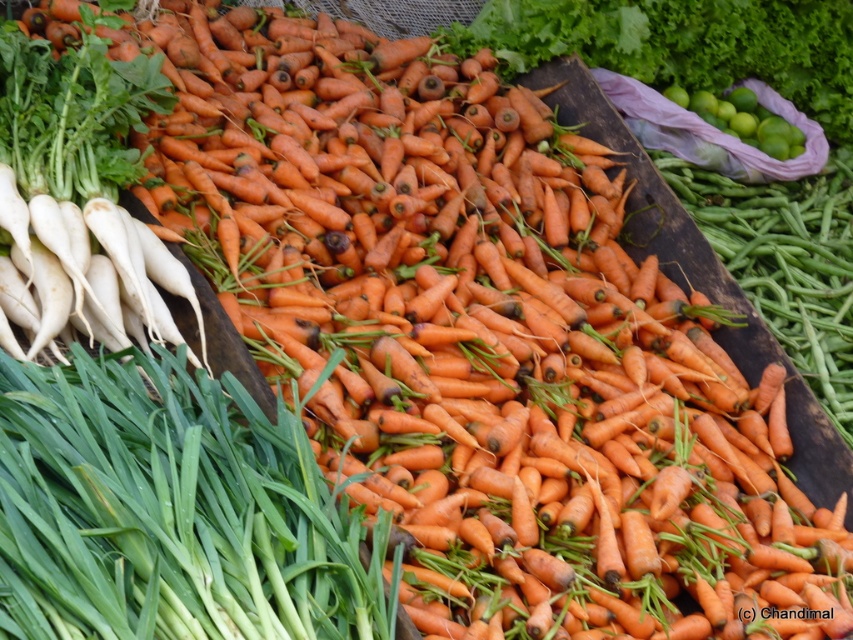
Does orange matte carrot at center-right have a larger size compared to green matte lime at upper right?

Correct, orange matte carrot at center-right is larger in size than green matte lime at upper right.

How much distance is there between orange matte carrot at center-right and green matte lime at upper right?

orange matte carrot at center-right and green matte lime at upper right are 76.03 centimeters apart from each other.

Locate an element on the screen. orange matte carrot at center-right is located at coordinates (786, 260).

From the picture: Is white smooth radish at left to the left of orange matte carrot at center-right from the viewer's perspective?

Yes, white smooth radish at left is to the left of orange matte carrot at center-right.

Consider the image. Can you confirm if white smooth radish at left is positioned above orange matte carrot at center-right?

Indeed, white smooth radish at left is positioned over orange matte carrot at center-right.

Between point (155, 266) and point (828, 406), which one is positioned behind?

Point (828, 406)

You are a GUI agent. You are given a task and a screenshot of the screen. Output one action in this format:
    pyautogui.click(x=<x>, y=<y>)
    Task: Click on the white smooth radish at left
    
    Given the screenshot: What is the action you would take?
    pyautogui.click(x=80, y=189)

Does white smooth radish at left lie in front of orange matte carrots at upper center?

Yes, it is.

Is point (62, 321) closer to viewer compared to point (521, 13)?

Yes, it is.

At what (x,y) coordinates should I click in order to perform the action: click on white smooth radish at left. Please return your answer as a coordinate pair (x, y). The height and width of the screenshot is (640, 853). Looking at the image, I should click on (80, 189).